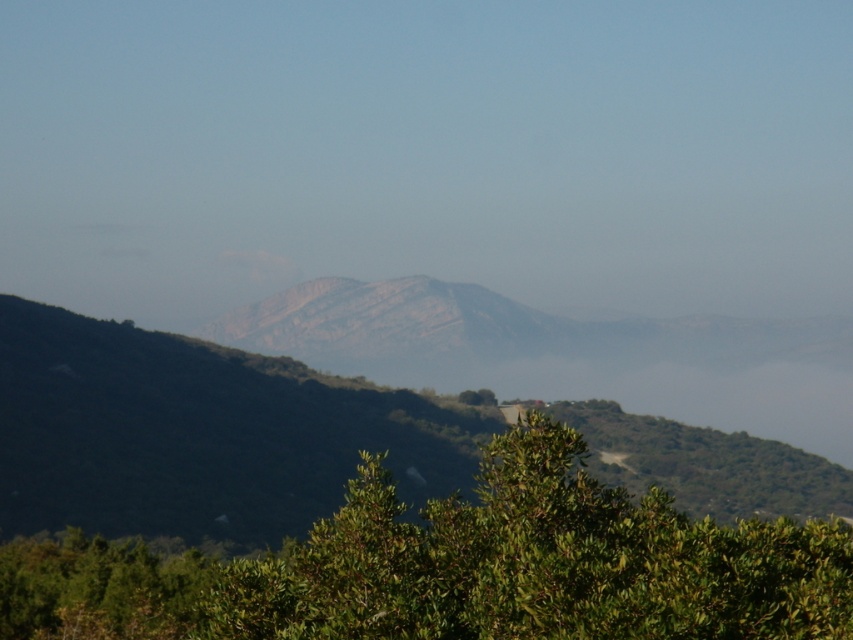
Can you confirm if green leafy tree at center is positioned above rugged stone mountain at center?

Yes, green leafy tree at center is above rugged stone mountain at center.

In order to click on green leafy tree at center in this screenshot , I will do `click(457, 566)`.

Does point (248, 628) lie behind point (693, 497)?

No.

Identify the location of green leafy tree at center. (457, 566).